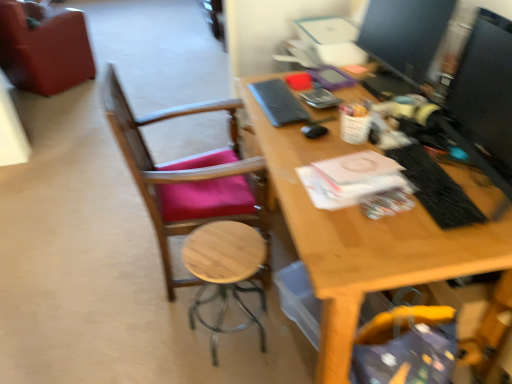
What is the approximate height of velvet-like red chair at upper left, the second chair in the front-to-back sequence?

It is 83.86 centimeters.

What do you see at coordinates (402, 42) in the screenshot?
I see `matte black monitor at upper right` at bounding box center [402, 42].

What is the approximate height of wooden stool at center?

The height of wooden stool at center is 19.24 inches.

What do you see at coordinates (225, 272) in the screenshot? I see `wooden stool at center` at bounding box center [225, 272].

Identify the location of wooden chair at left, which is the first chair in front-to-back order. (187, 176).

Image resolution: width=512 pixels, height=384 pixels. I want to click on chair that appears below the matte black monitor at upper right (from the image's perspective), so click(x=187, y=176).

How different are the orientations of wooden chair at left, which is the first chair in front-to-back order, and matte black monitor at upper right in degrees?

176 degrees.

Relative to matte black monitor at upper right, is wooden chair at left, which is the first chair in front-to-back order, in front or behind?

wooden chair at left, which is the first chair in front-to-back order, is positioned closer to the viewer than matte black monitor at upper right.

Would you say wooden chair at left, which ranks as the 2th chair in top-to-bottom order, is outside matte black monitor at upper right?

wooden chair at left, which ranks as the 2th chair in top-to-bottom order, lies outside matte black monitor at upper right's area.

In terms of width, does wooden chair at left, acting as the second chair starting from the back, look wider or thinner when compared to wooden stool at center?

Clearly, wooden chair at left, acting as the second chair starting from the back, has more width compared to wooden stool at center.

In the scene shown: Considering the relative positions of wooden chair at left, which is the first chair in front-to-back order, and wooden stool at center in the image provided, is wooden chair at left, which is the first chair in front-to-back order, to the left or to the right of wooden stool at center?

wooden chair at left, which is the first chair in front-to-back order, is to the left of wooden stool at center.

From the image's perspective, which one is positioned lower, wooden chair at left, which ranks as the 2th chair in top-to-bottom order, or wooden stool at center?

wooden stool at center is shown below in the image.

Is wooden chair at left, marked as the 1th chair in a right-to-left arrangement, facing away from wooden stool at center?

No, wooden chair at left, marked as the 1th chair in a right-to-left arrangement,'s orientation is not away from wooden stool at center.

From a real-world perspective, which object rests below the other?

In real-world perspective, wooden stool at center is lower.

From the picture: Is wooden stool at center with matte black monitor at upper right?

wooden stool at center and matte black monitor at upper right are clearly separated.

Does wooden stool at center have a greater height compared to matte black monitor at upper right?

Indeed, wooden stool at center has a greater height compared to matte black monitor at upper right.

Who is bigger, wooden stool at center or matte black monitor at upper right?

With larger size is wooden stool at center.

From the image's perspective, is black textured laptop keyboard at right above or below velvet-like red chair at upper left, arranged as the first chair when viewed from the back?

From the image's perspective, black textured laptop keyboard at right appears below velvet-like red chair at upper left, arranged as the first chair when viewed from the back.

Which is farther from the camera, (441, 201) or (54, 61)?

The point (54, 61) is more distant.

Would you say velvet-like red chair at upper left, which is counted as the 2th chair, starting from the right, is part of black textured laptop keyboard at right's contents?

No, velvet-like red chair at upper left, which is counted as the 2th chair, starting from the right, is not surrounded by black textured laptop keyboard at right.

From a real-world perspective, which object stands above the other?

black textured laptop keyboard at right, from a real-world perspective.

Can you confirm if black textured laptop keyboard at right is thinner than matte black monitor at upper right?

Yes, black textured laptop keyboard at right is thinner than matte black monitor at upper right.

How different are the orientations of black textured laptop keyboard at right and matte black monitor at upper right in degrees?

The facing directions of black textured laptop keyboard at right and matte black monitor at upper right are 6.09 degrees apart.

Between black textured laptop keyboard at right and matte black monitor at upper right, which one has less height?

Standing shorter between the two is black textured laptop keyboard at right.

Identify the location of laptop keyboard in front of the matte black monitor at upper right. The image size is (512, 384). (435, 187).

Looking at this image, does matte black monitor at upper right have a greater width compared to black textured laptop keyboard at right?

Indeed, matte black monitor at upper right has a greater width compared to black textured laptop keyboard at right.

From the image's perspective, relative to black textured laptop keyboard at right, is matte black monitor at upper right above or below?

matte black monitor at upper right is situated higher than black textured laptop keyboard at right in the image.

Is matte black monitor at upper right further to the viewer compared to black textured laptop keyboard at right?

That is True.

Is matte black monitor at upper right bigger or smaller than black textured laptop keyboard at right?

matte black monitor at upper right is bigger than black textured laptop keyboard at right.

Is wooden stool at center not inside wooden chair at left, the 2th chair in the left-to-right sequence?

A: Indeed, wooden stool at center is completely outside wooden chair at left, the 2th chair in the left-to-right sequence.

From the picture: From a real-world perspective, is wooden stool at center below wooden chair at left, which is the 1th chair from bottom to top?

Yes.

Is wooden stool at center positioned with its back to wooden chair at left, which is the first chair in front-to-back order?

No, wooden stool at center is not facing the opposite direction of wooden chair at left, which is the first chair in front-to-back order.

From a real-world perspective, which chair is the 1st one underneath the matte black monitor at upper right? Please provide its 2D coordinates.

[(187, 176)]

This screenshot has height=384, width=512. I want to click on the 1st chair above the wooden stool at center (from the image's perspective), so click(187, 176).

From the image, which object appears to be nearer to velvet-like red chair at upper left, marked as the 1th chair in a left-to-right arrangement, wooden stool at center or wooden chair at left, which is the first chair in front-to-back order?

wooden chair at left, which is the first chair in front-to-back order, is closer to velvet-like red chair at upper left, marked as the 1th chair in a left-to-right arrangement.

Estimate the real-world distances between objects in this image. Which object is closer to matte black monitor at upper right, black textured laptop keyboard at right or wooden chair at left, which is the first chair in front-to-back order?

Based on the image, black textured laptop keyboard at right appears to be nearer to matte black monitor at upper right.

Looking at the image, which one is located closer to black textured laptop keyboard at right, wooden stool at center or velvet-like red chair at upper left, arranged as the first chair when viewed from the back?

Among the two, wooden stool at center is located nearer to black textured laptop keyboard at right.

When comparing their distances from velvet-like red chair at upper left, arranged as the first chair when viewed from the back, does black textured laptop keyboard at right or wooden chair at left, which is the first chair in front-to-back order, seem closer?

wooden chair at left, which is the first chair in front-to-back order, lies closer to velvet-like red chair at upper left, arranged as the first chair when viewed from the back, than the other object.

Looking at the image, which one is located further to wooden chair at left, which is the 1th chair from bottom to top, wooden stool at center or black textured laptop keyboard at right?

The object further to wooden chair at left, which is the 1th chair from bottom to top, is black textured laptop keyboard at right.

When comparing their distances from wooden stool at center, does black textured laptop keyboard at right or wooden chair at left, which is the first chair in front-to-back order, seem further?

black textured laptop keyboard at right is further to wooden stool at center.

Which object lies further to the anchor point velvet-like red chair at upper left, which is counted as the 2th chair, starting from the right, wooden stool at center or matte black monitor at upper right?

matte black monitor at upper right is further to velvet-like red chair at upper left, which is counted as the 2th chair, starting from the right.

From the image, which object appears to be nearer to black textured laptop keyboard at right, wooden chair at left, marked as the 1th chair in a right-to-left arrangement, or wooden stool at center?

wooden stool at center.

Find the location of a particular element. The height and width of the screenshot is (384, 512). laptop keyboard between matte black monitor at upper right and wooden stool at center in the up-down direction is located at coordinates (435, 187).

This screenshot has height=384, width=512. Identify the location of chair located between velvet-like red chair at upper left, arranged as the first chair when viewed from the back, and black textured laptop keyboard at right in the left-right direction. (187, 176).

Image resolution: width=512 pixels, height=384 pixels. In order to click on laptop keyboard between wooden chair at left, the 2th chair in the left-to-right sequence, and matte black monitor at upper right in this screenshot , I will do `click(435, 187)`.

Where is `chair situated between velvet-like red chair at upper left, the second chair in the front-to-back sequence, and matte black monitor at upper right from left to right`? This screenshot has height=384, width=512. chair situated between velvet-like red chair at upper left, the second chair in the front-to-back sequence, and matte black monitor at upper right from left to right is located at coordinates (187, 176).